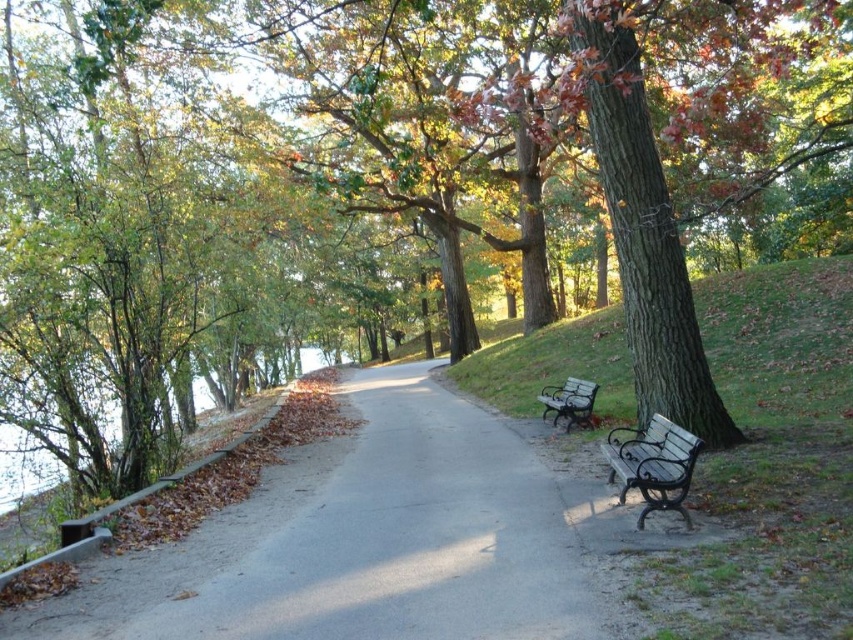
You are standing at the entrance of the park and want to reach a bench located at point (393, 468) and another at point (576, 420). Which bench will you encounter first while walking along the path?

You will encounter the bench at point (393, 468) first because it is closer to you than the bench at point (576, 420).